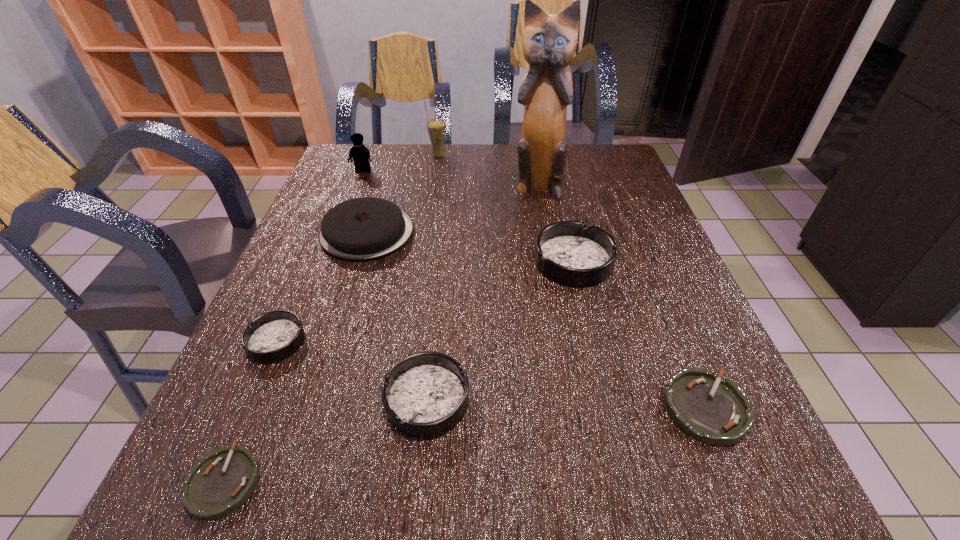
The width and height of the screenshot is (960, 540). I want to click on free space between the third tallest object and the fourth ashtray from left to right, so click(x=468, y=216).

Image resolution: width=960 pixels, height=540 pixels. What are the coordinates of `free spot between the sixth tallest object and the smaller green ashtray` in the screenshot? It's located at (325, 440).

The width and height of the screenshot is (960, 540). Identify the location of empty space between the farthest object and the left green ashtray. (331, 318).

You are a GUI agent. You are given a task and a screenshot of the screen. Output one action in this format:
    pyautogui.click(x=<x>, y=<y>)
    Task: Click on the free point between the second farthest dark ashtray and the second ashtray from right to left
    
    Given the screenshot: What is the action you would take?
    pyautogui.click(x=425, y=301)

You are a GUI agent. You are given a task and a screenshot of the screen. Output one action in this format:
    pyautogui.click(x=<x>, y=<y>)
    Task: Click on the unoccupied area between the nearest dark ashtray and the pancake
    The height and width of the screenshot is (540, 960).
    Given the screenshot: What is the action you would take?
    pyautogui.click(x=397, y=316)

Identify the location of free area in between the pancake and the cat. (452, 208).

Point out which object is positioned as the fourth nearest to the cat. Please provide its 2D coordinates. Your answer should be formatted as a tuple, i.e. [(x, y)], where the tuple contains the x and y coordinates of a point satisfying the conditions above.

[(361, 155)]

Select which object is the sixth closest to the rightmost ashtray. Please provide its 2D coordinates. Your answer should be formatted as a tuple, i.e. [(x, y)], where the tuple contains the x and y coordinates of a point satisfying the conditions above.

[(273, 336)]

Locate which ashtray ranks fourth in proximity to the farthest ashtray. Please provide its 2D coordinates. Your answer should be formatted as a tuple, i.e. [(x, y)], where the tuple contains the x and y coordinates of a point satisfying the conditions above.

[(220, 482)]

Identify which ashtray is the fifth closest to the cat. Please provide its 2D coordinates. Your answer should be formatted as a tuple, i.e. [(x, y)], where the tuple contains the x and y coordinates of a point satisfying the conditions above.

[(220, 482)]